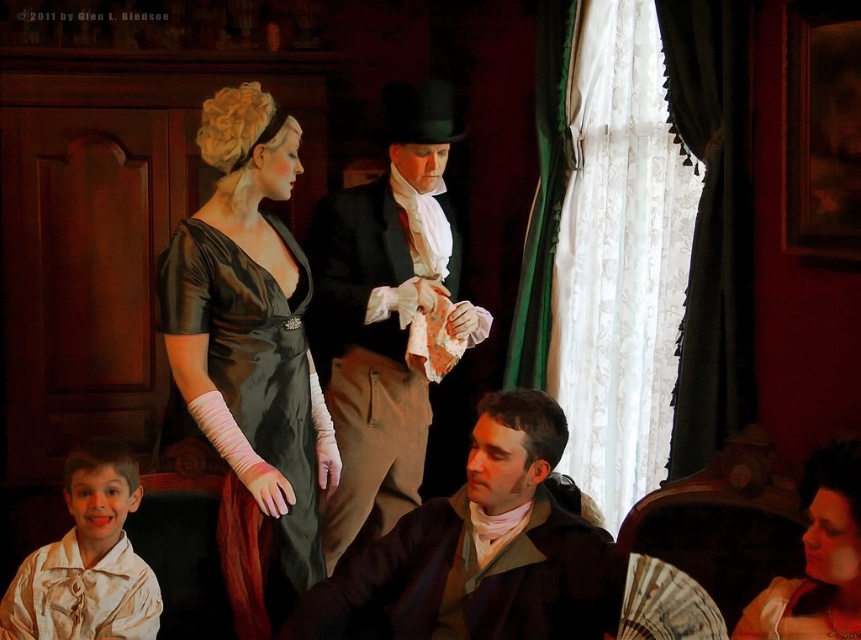
In the historical setting depicted, there is a woman in a dark dress with long white gloves on the left side of the frame and a point marked at coordinates (x=383, y=310). What object is located at that point?

The point at coordinates (x=383, y=310) indicates a smooth black suit at center.